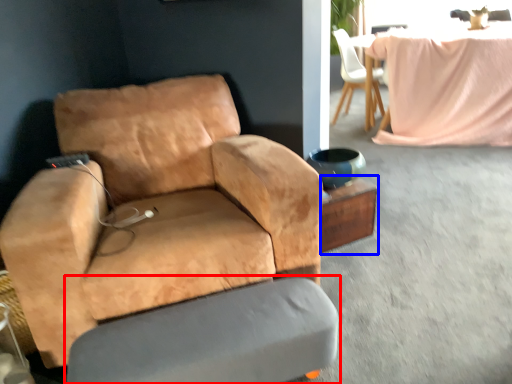
Question: Among these objects, which one is farthest to the camera, swivel chair (highlighted by a red box) or side table (highlighted by a blue box)?

Choices:
 (A) swivel chair
 (B) side table

Answer: (B)